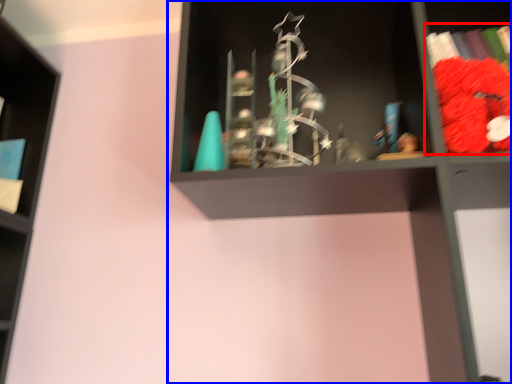
Question: Which object appears farthest to the camera in this image, book (highlighted by a red box) or shelf (highlighted by a blue box)?

Choices:
 (A) book
 (B) shelf

Answer: (A)